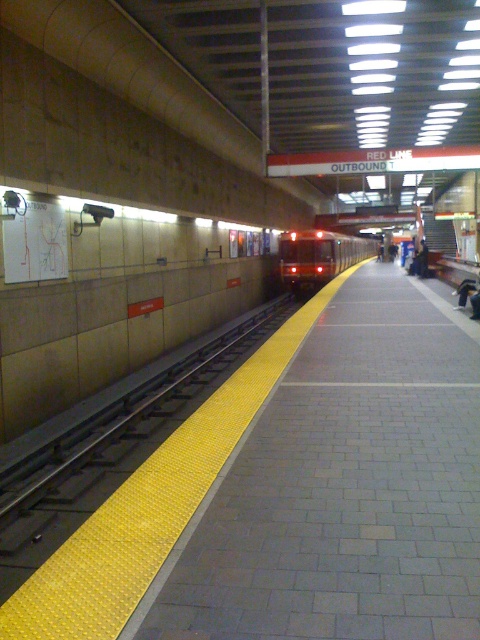
Does yellow textured platform at center appear under red glossy train at center?

Indeed, yellow textured platform at center is positioned under red glossy train at center.

Who is more distant from viewer, (351,346) or (300,256)?

Positioned behind is point (300,256).

Measure the distance between yellow textured platform at center and camera.

2.82 meters

Find the location of a particular element. The image size is (480, 640). yellow textured platform at center is located at coordinates (345, 486).